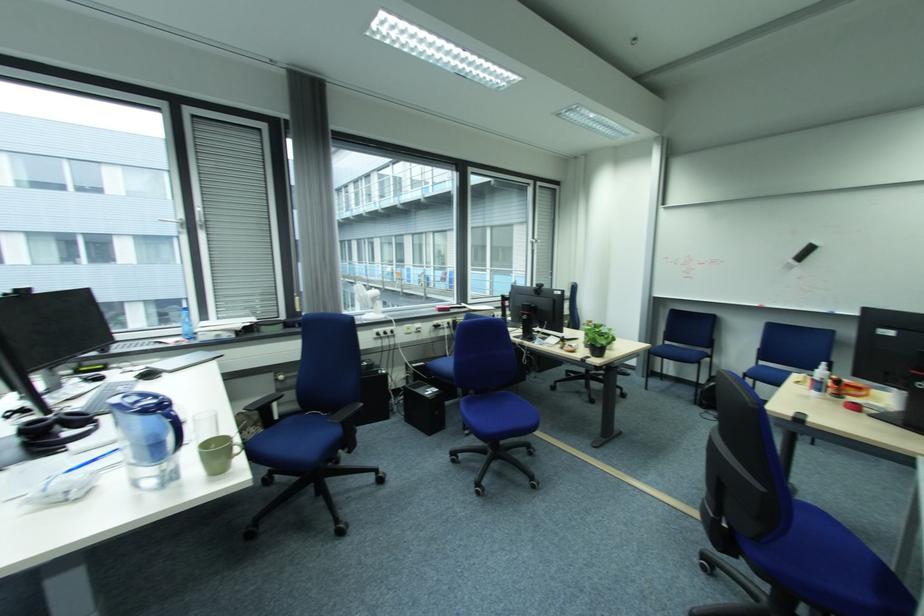
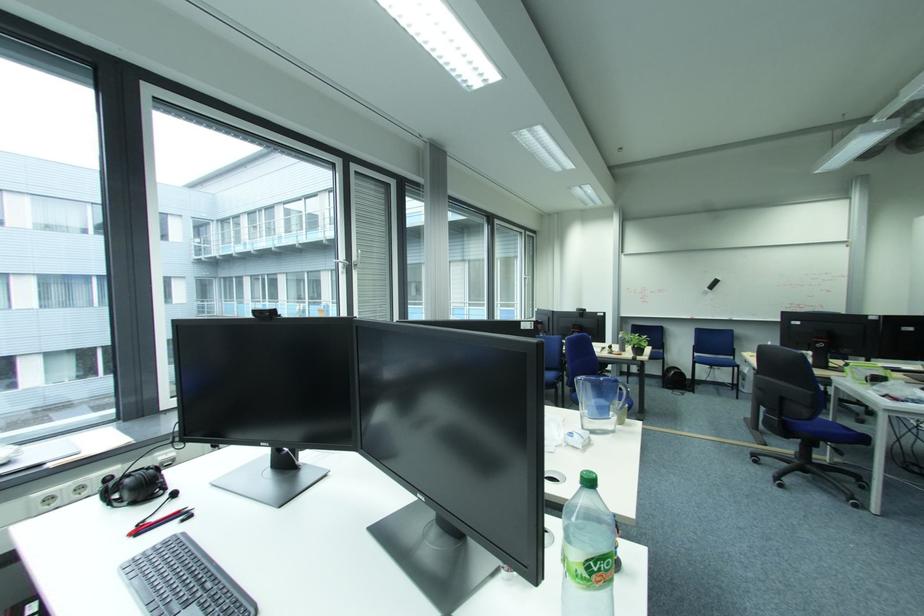
Question: Which direction would the cameraman need to move to produce the second image? Reply with the corresponding letter.

Choices:
 (A) Left
 (B) Right
 (C) Forward
 (D) Backward

Answer: (A)